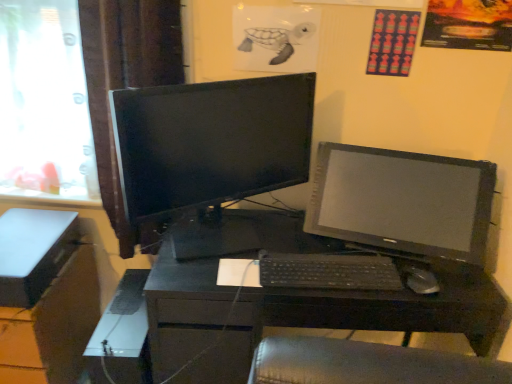
Describe the element at coordinates (33, 252) in the screenshot. Image resolution: width=512 pixels, height=384 pixels. I see `matte plastic box at lower left` at that location.

Where is `satin black monitor at right, positioned as the first computer monitor in right-to-left order`? The width and height of the screenshot is (512, 384). satin black monitor at right, positioned as the first computer monitor in right-to-left order is located at coordinates (402, 201).

Identify the location of black matte desk at center. (356, 317).

The height and width of the screenshot is (384, 512). What do you see at coordinates (356, 317) in the screenshot?
I see `black matte desk at center` at bounding box center [356, 317].

Identify the location of black glossy monitor at center, which is the 2th computer monitor in right-to-left order. The image size is (512, 384). point(209,144).

Image resolution: width=512 pixels, height=384 pixels. Describe the element at coordinates (209, 144) in the screenshot. I see `black glossy monitor at center, which is the 2th computer monitor in right-to-left order` at that location.

Identify the location of brown fabric curtain at left. (126, 86).

This screenshot has width=512, height=384. Identify the location of matte plastic box at lower left. (33, 252).

Considering their positions, is black plastic mouse at center located in front of or behind black glossy monitor at center, which is the 2th computer monitor in right-to-left order?

Visually, black plastic mouse at center is located behind black glossy monitor at center, which is the 2th computer monitor in right-to-left order.

From a real-world perspective, who is located higher, black plastic mouse at center or black glossy monitor at center, which is the 2th computer monitor in right-to-left order?

From a 3D spatial view, black glossy monitor at center, which is the 2th computer monitor in right-to-left order, is above.

From the picture: Is black plastic mouse at center inside or outside of black glossy monitor at center, which is the 2th computer monitor in right-to-left order?

black plastic mouse at center is located beyond the bounds of black glossy monitor at center, which is the 2th computer monitor in right-to-left order.

Which of these two, black plastic mouse at center or black glossy monitor at center, which is the 2th computer monitor in right-to-left order, is thinner?

black plastic mouse at center is thinner.

Which object is positioned more to the right, black matte desk at center or matte plastic box at lower left?

From the viewer's perspective, black matte desk at center appears more on the right side.

Is point (226, 335) positioned after point (10, 295)?

No, it is in front of (10, 295).

From a real-world perspective, is black matte desk at center on matte plastic box at lower left?

Incorrect, from a real-world perspective, black matte desk at center is lower than matte plastic box at lower left.

Which object is positioned more to the right, black glossy monitor at center, which is counted as the 1th computer monitor, starting from the left, or brown fabric curtain at left?

black glossy monitor at center, which is counted as the 1th computer monitor, starting from the left, is more to the right.

Does point (275, 99) lie behind point (143, 49)?

No, it is in front of (143, 49).

Can you confirm if black glossy monitor at center, which is the 2th computer monitor in right-to-left order, is thinner than brown fabric curtain at left?

Yes, black glossy monitor at center, which is the 2th computer monitor in right-to-left order, is thinner than brown fabric curtain at left.

How many degrees apart are the facing directions of black glossy monitor at center, which is counted as the 1th computer monitor, starting from the left, and brown fabric curtain at left?

The angle between the facing direction of black glossy monitor at center, which is counted as the 1th computer monitor, starting from the left, and the facing direction of brown fabric curtain at left is 36.6 degrees.

Where is `computer monitor that is the 1st one below the transparent glass window at left (from a real-world perspective)`? computer monitor that is the 1st one below the transparent glass window at left (from a real-world perspective) is located at coordinates (209, 144).

From the picture: Considering the sizes of objects black glossy monitor at center, which is the 2th computer monitor in right-to-left order, and transparent glass window at left in the image provided, who is smaller, black glossy monitor at center, which is the 2th computer monitor in right-to-left order, or transparent glass window at left?

transparent glass window at left.

Looking at this image, from a real-world perspective, is black glossy monitor at center, which is counted as the 1th computer monitor, starting from the left, under transparent glass window at left?

Yes.

Based on the photo, considering the sizes of objects black glossy monitor at center, which is counted as the 1th computer monitor, starting from the left, and transparent glass window at left in the image provided, who is wider, black glossy monitor at center, which is counted as the 1th computer monitor, starting from the left, or transparent glass window at left?

black glossy monitor at center, which is counted as the 1th computer monitor, starting from the left.

How many degrees apart are the facing directions of matte black file cabinet at lower left and black glossy monitor at center, which is counted as the 1th computer monitor, starting from the left?

35.3 degrees.

From the image's perspective, is matte black file cabinet at lower left located beneath black glossy monitor at center, which is counted as the 1th computer monitor, starting from the left?

Yes.

Does matte black file cabinet at lower left have a larger size compared to black glossy monitor at center, which is counted as the 1th computer monitor, starting from the left?

Correct, matte black file cabinet at lower left is larger in size than black glossy monitor at center, which is counted as the 1th computer monitor, starting from the left.

Is matte black file cabinet at lower left inside the boundaries of black glossy monitor at center, which is the 2th computer monitor in right-to-left order, or outside?

matte black file cabinet at lower left is spatially situated outside black glossy monitor at center, which is the 2th computer monitor in right-to-left order.

Is point (106, 88) closer to viewer compared to point (389, 317)?

No, (106, 88) is further to viewer.

Considering the relative sizes of brown fabric curtain at left and black matte desk at center in the image provided, is brown fabric curtain at left wider than black matte desk at center?

No, brown fabric curtain at left is not wider than black matte desk at center.

Locate an element on the screen. Image resolution: width=512 pixels, height=384 pixels. desk in front of the brown fabric curtain at left is located at coordinates (356, 317).

Does white plastic computer tower at lower left turn towards satin black monitor at right, positioned as the first computer monitor in right-to-left order?

No, white plastic computer tower at lower left does not turn towards satin black monitor at right, positioned as the first computer monitor in right-to-left order.

Does white plastic computer tower at lower left appear on the right side of satin black monitor at right, positioned as the first computer monitor in right-to-left order?

No, white plastic computer tower at lower left is not to the right of satin black monitor at right, positioned as the first computer monitor in right-to-left order.

Is point (125, 364) closer or farther from the camera than point (373, 225)?

Point (125, 364) appears to be closer to the viewer than point (373, 225).

Is satin black monitor at right, positioned as the first computer monitor in right-to-left order, located within white plastic computer tower at lower left?

No, white plastic computer tower at lower left does not contain satin black monitor at right, positioned as the first computer monitor in right-to-left order.

Where is `computer monitor that is the 2nd one when counting upward from the black plastic mouse at center (from the image's perspective)`? computer monitor that is the 2nd one when counting upward from the black plastic mouse at center (from the image's perspective) is located at coordinates (209, 144).

You are a GUI agent. You are given a task and a screenshot of the screen. Output one action in this format:
    pyautogui.click(x=<x>, y=<y>)
    Task: Click on the desk in front of the matte plastic box at lower left
    The height and width of the screenshot is (384, 512).
    Given the screenshot: What is the action you would take?
    356,317

From the image, which object appears to be nearer to matte plastic box at lower left, black matte desk at center or white plastic computer tower at lower left?

The object closer to matte plastic box at lower left is white plastic computer tower at lower left.

Considering their positions, is black glossy monitor at center, which is the 2th computer monitor in right-to-left order, positioned further to white plastic computer tower at lower left than black plastic keyboard at center?

Among the two, black plastic keyboard at center is located further to white plastic computer tower at lower left.

From the image, which object appears to be nearer to black plastic keyboard at center, transparent glass window at left or black glossy monitor at center, which is counted as the 1th computer monitor, starting from the left?

Among the two, black glossy monitor at center, which is counted as the 1th computer monitor, starting from the left, is located nearer to black plastic keyboard at center.

Estimate the real-world distances between objects in this image. Which object is closer to black glossy monitor at center, which is counted as the 1th computer monitor, starting from the left, black plastic keyboard at center or brown fabric curtain at left?

The object closer to black glossy monitor at center, which is counted as the 1th computer monitor, starting from the left, is brown fabric curtain at left.

From the image, which object appears to be farther from black glossy monitor at center, which is the 2th computer monitor in right-to-left order, brown fabric curtain at left or transparent glass window at left?

Among the two, transparent glass window at left is located further to black glossy monitor at center, which is the 2th computer monitor in right-to-left order.

From the image, which object appears to be nearer to white plastic computer tower at lower left, black plastic keyboard at center or satin black monitor at right, placed as the 2th computer monitor when sorted from left to right?

Based on the image, black plastic keyboard at center appears to be nearer to white plastic computer tower at lower left.

Looking at the image, which one is located further to white plastic computer tower at lower left, matte black file cabinet at lower left or matte plastic box at lower left?

Among the two, matte plastic box at lower left is located further to white plastic computer tower at lower left.

Consider the image. Looking at the image, which one is located further to transparent glass window at left, matte plastic box at lower left or black glossy monitor at center, which is the 2th computer monitor in right-to-left order?

Based on the image, black glossy monitor at center, which is the 2th computer monitor in right-to-left order, appears to be further to transparent glass window at left.

In order to click on computer monitor situated between matte plastic box at lower left and black matte desk at center from left to right in this screenshot , I will do `click(209, 144)`.

In order to click on curtain between white plastic computer tower at lower left and black plastic mouse at center in the horizontal direction in this screenshot , I will do `click(126, 86)`.

You are a GUI agent. You are given a task and a screenshot of the screen. Output one action in this format:
    pyautogui.click(x=<x>, y=<y>)
    Task: Click on the file cabinet between brown fabric curtain at left and white plastic computer tower at lower left in the vertical direction
    Image resolution: width=512 pixels, height=384 pixels.
    Given the screenshot: What is the action you would take?
    pyautogui.click(x=45, y=296)

Where is `desk situated between brown fabric curtain at left and black plastic mouse at center from left to right`? This screenshot has height=384, width=512. desk situated between brown fabric curtain at left and black plastic mouse at center from left to right is located at coordinates [x=356, y=317].